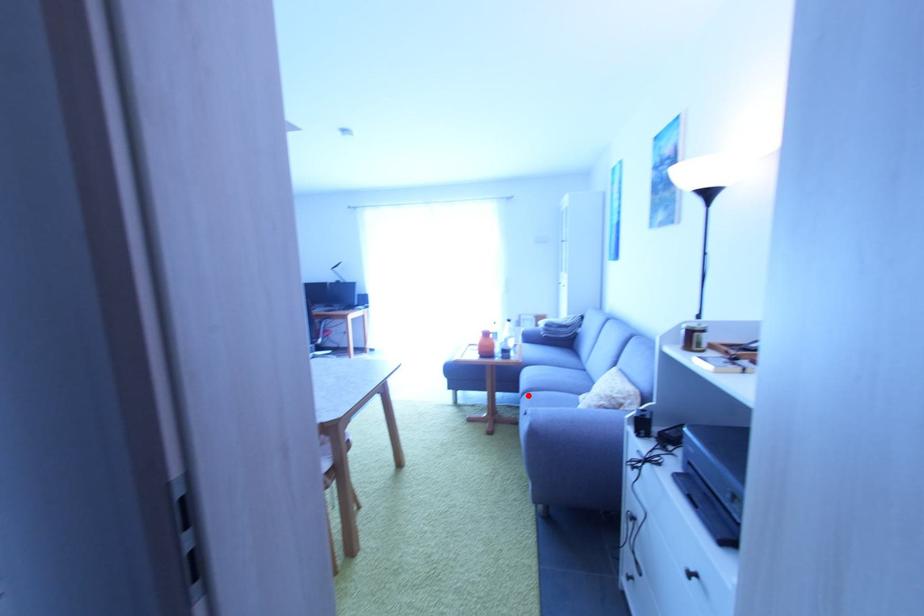
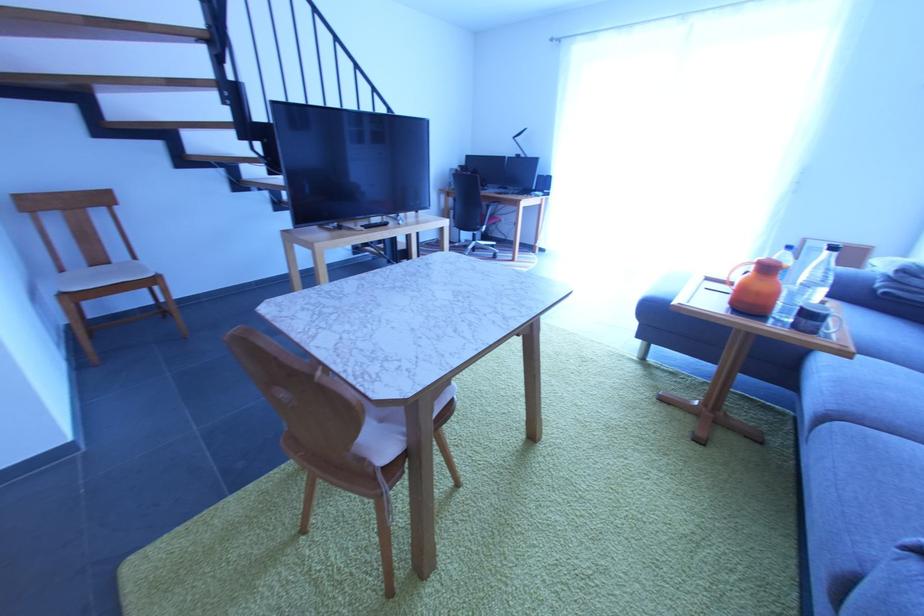
Find the pixel in the second image that matches the highlighted location in the first image.

(833, 419)